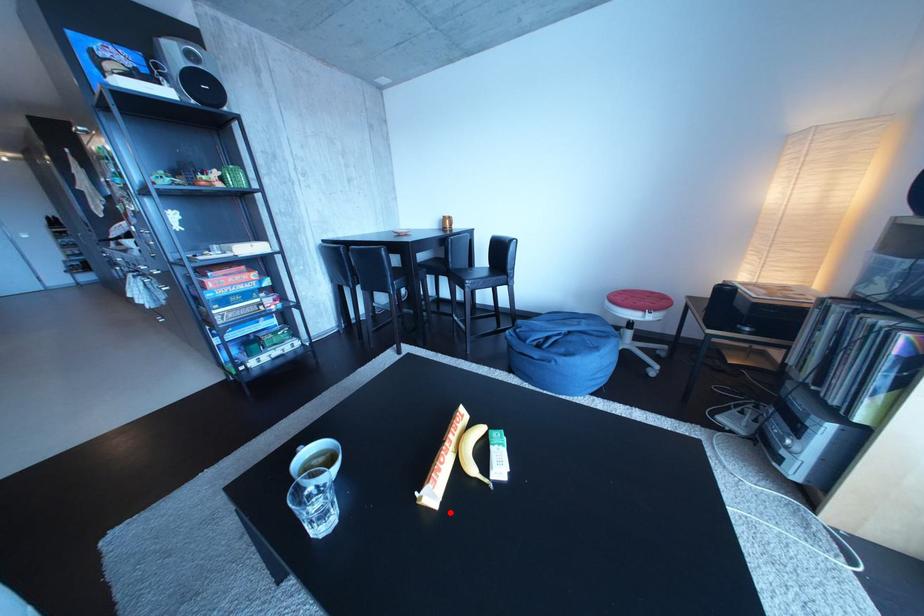
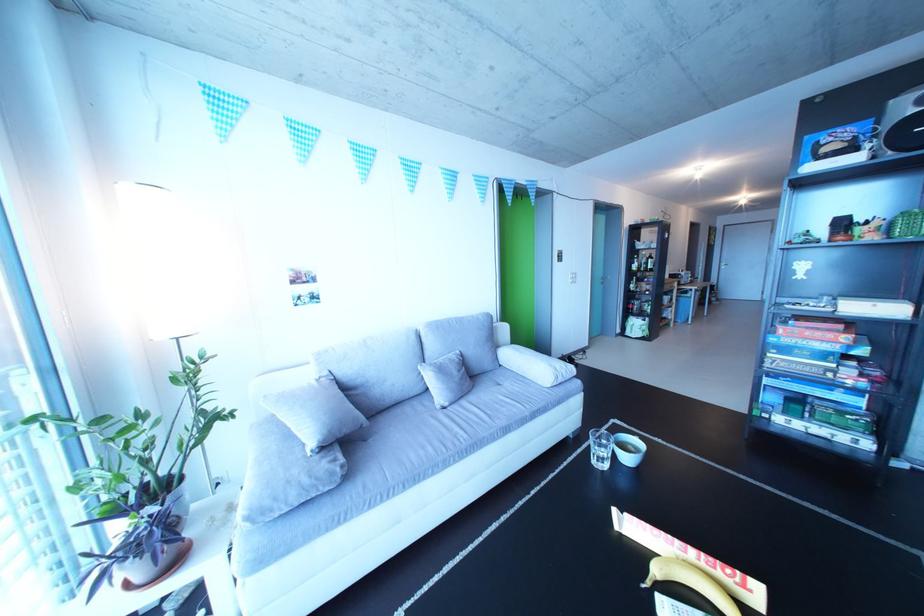
Locate, in the second image, the point that corresponds to the highlighted location in the first image.

(630, 533)